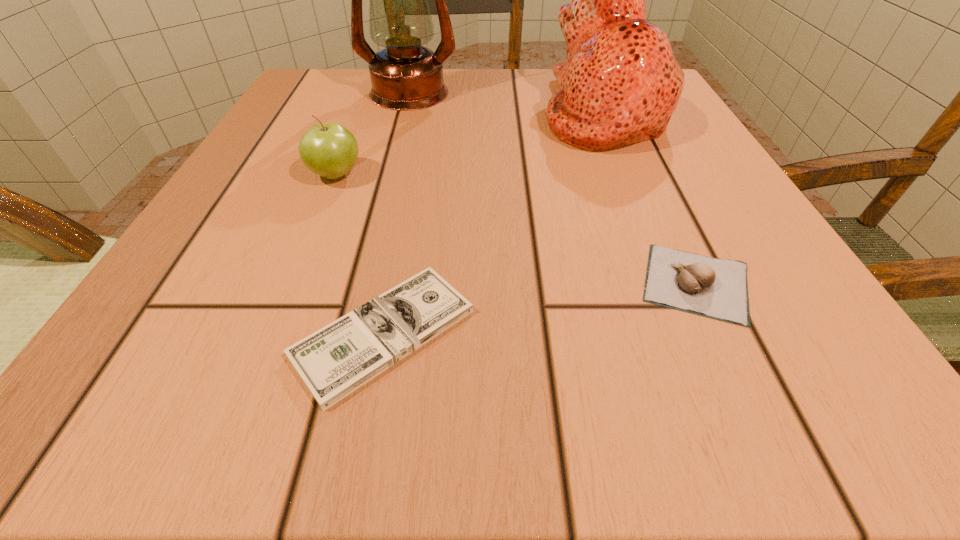
Image resolution: width=960 pixels, height=540 pixels. I want to click on oil lamp, so click(x=405, y=76).

Where is `the second tallest object`? Image resolution: width=960 pixels, height=540 pixels. the second tallest object is located at coordinates (620, 84).

Identify the location of the third nearest object. (330, 150).

Locate an element on the screen. This screenshot has height=540, width=960. apple is located at coordinates (330, 150).

Locate an element on the screen. the second shortest object is located at coordinates (716, 288).

I want to click on the shortest object, so click(336, 360).

The image size is (960, 540). What are the coordinates of `vacant space located on the front of the oil lamp` in the screenshot? It's located at (398, 132).

This screenshot has width=960, height=540. Identify the location of free space located 0.210m on the face of the second tallest object. (429, 110).

This screenshot has width=960, height=540. I want to click on free space located 0.350m on the face of the second tallest object, so click(x=354, y=110).

Locate an element on the screen. This screenshot has height=540, width=960. vacant space situated 0.390m on the face of the second tallest object is located at coordinates (333, 110).